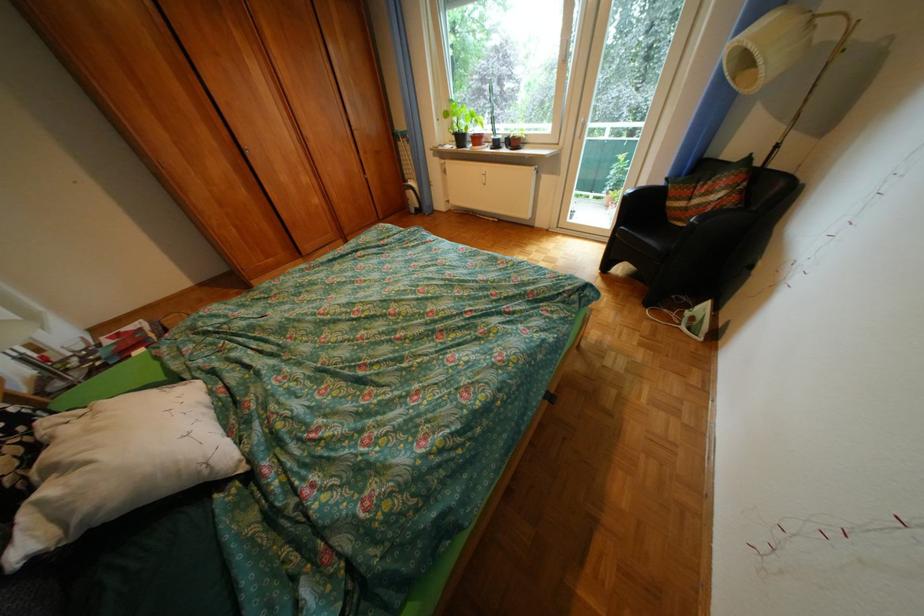
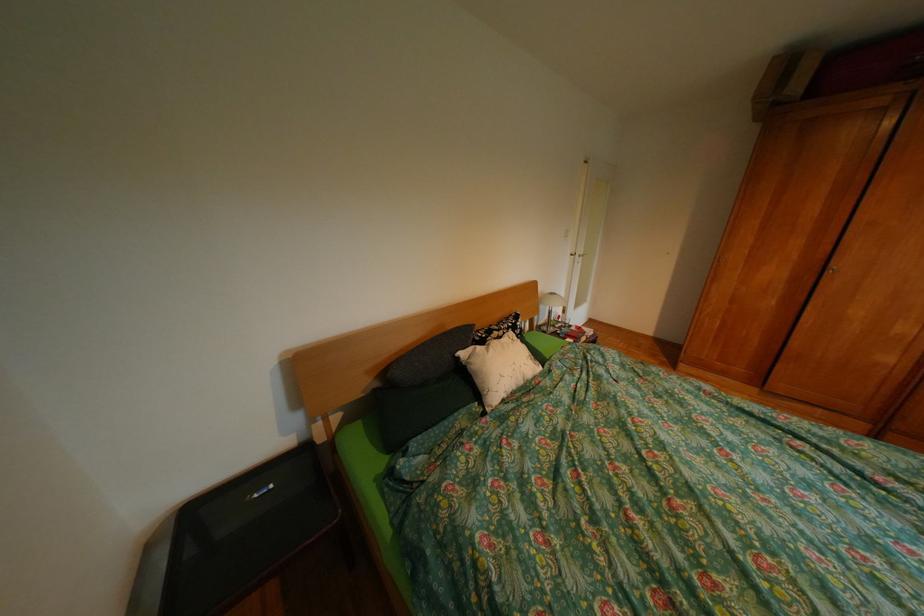
Find the pixel in the second image that matches the point at 43,546 in the first image.

(477, 354)